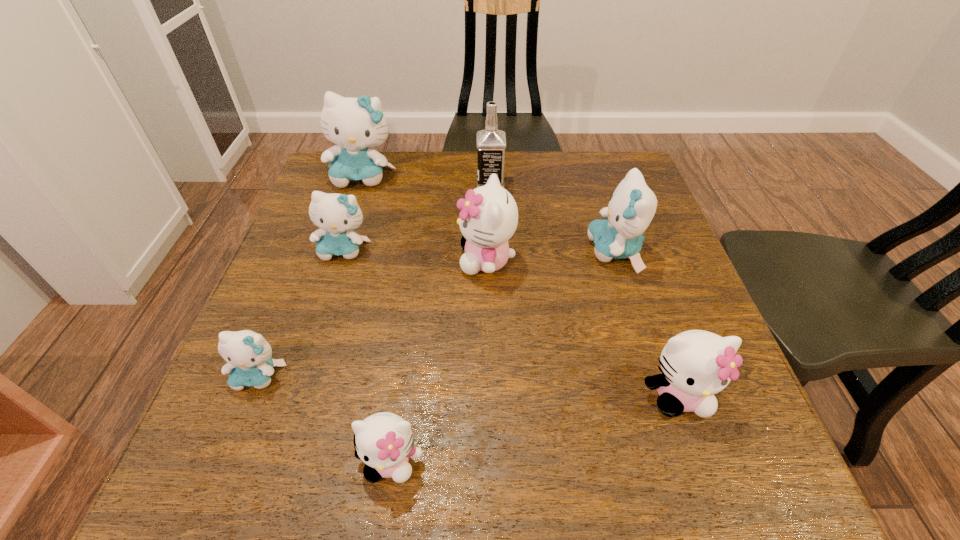
At what (x,y) coordinates should I click in order to perform the action: click on free space located on the front-facing side of the third kitten from right to left. Please return your answer as a coordinate pair (x, y). Looking at the image, I should click on (306, 260).

Where is `vacant space located 0.200m on the front-facing side of the third kitten from right to left`? The height and width of the screenshot is (540, 960). vacant space located 0.200m on the front-facing side of the third kitten from right to left is located at coordinates (370, 260).

The width and height of the screenshot is (960, 540). Identify the location of free location located 0.170m on the face of the second smallest blue kitten. (320, 326).

The image size is (960, 540). I want to click on vacant region located 0.070m on the front-facing side of the rightmost white kitten, so [704, 467].

Where is `vacant space situated on the face of the smallest blue kitten`? Image resolution: width=960 pixels, height=540 pixels. vacant space situated on the face of the smallest blue kitten is located at coordinates (238, 428).

Identify the location of kitten that is at the far edge. (355, 124).

Locate an element on the screen. The height and width of the screenshot is (540, 960). vodka at the far edge is located at coordinates (491, 143).

Locate an element on the screen. The image size is (960, 540). object at the near edge is located at coordinates (384, 441).

Where is `object at the far left corner`? This screenshot has width=960, height=540. object at the far left corner is located at coordinates (355, 124).

At what (x,y) coordinates should I click in order to perform the action: click on free region at the far edge of the desktop. Please return your answer as a coordinate pair (x, y). Looking at the image, I should click on (542, 152).